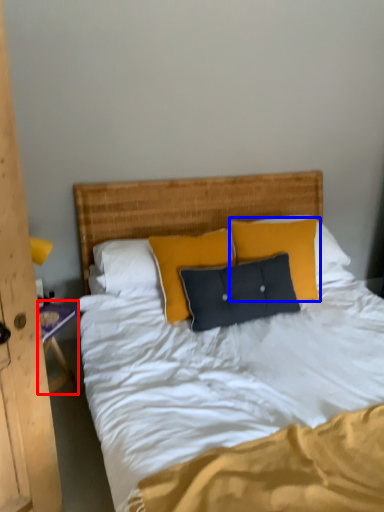
Question: Which object appears farthest to the camera in this image, nightstand (highlighted by a red box) or pillow (highlighted by a blue box)?

Choices:
 (A) nightstand
 (B) pillow

Answer: (B)